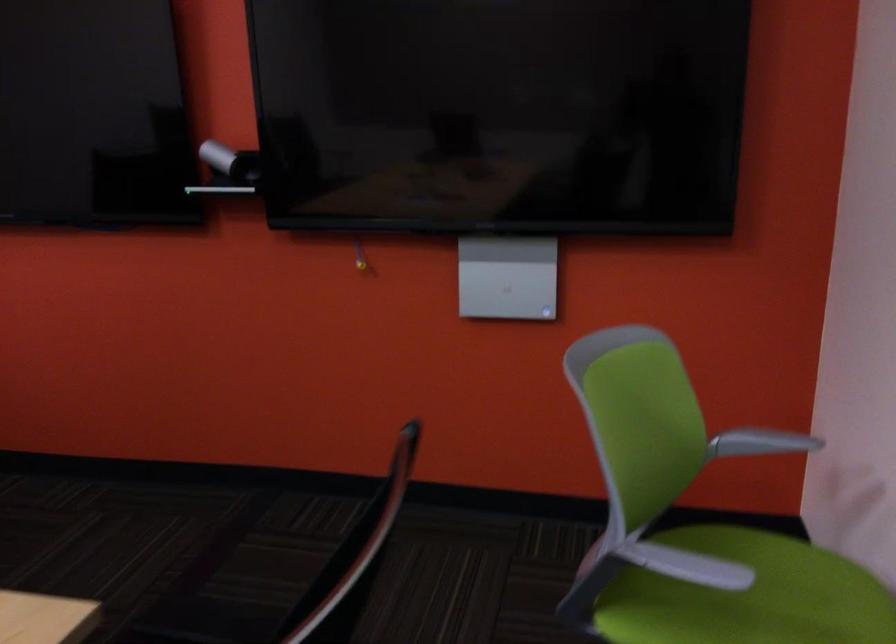
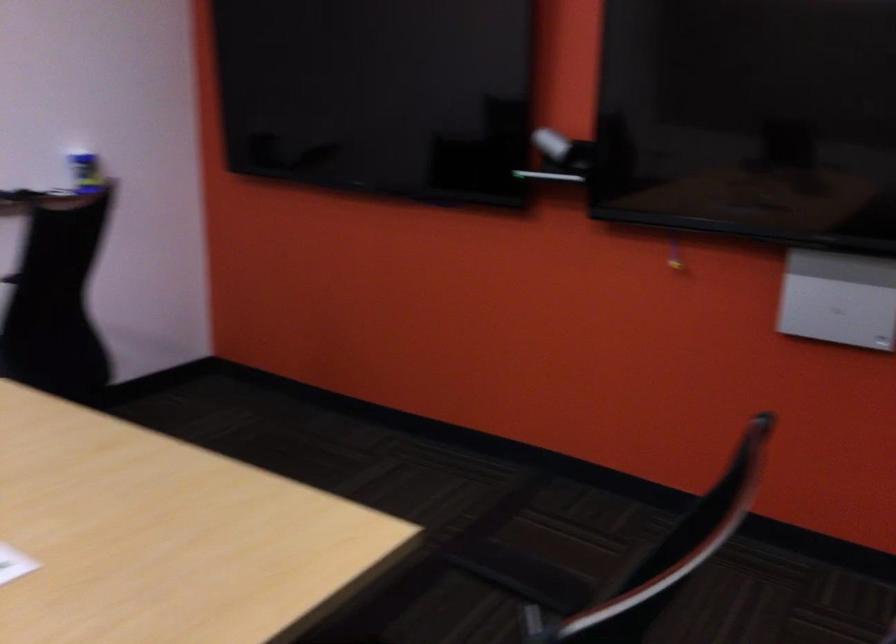
What movement of the cameraman would produce the second image?

The cameraman walked toward right, forward.